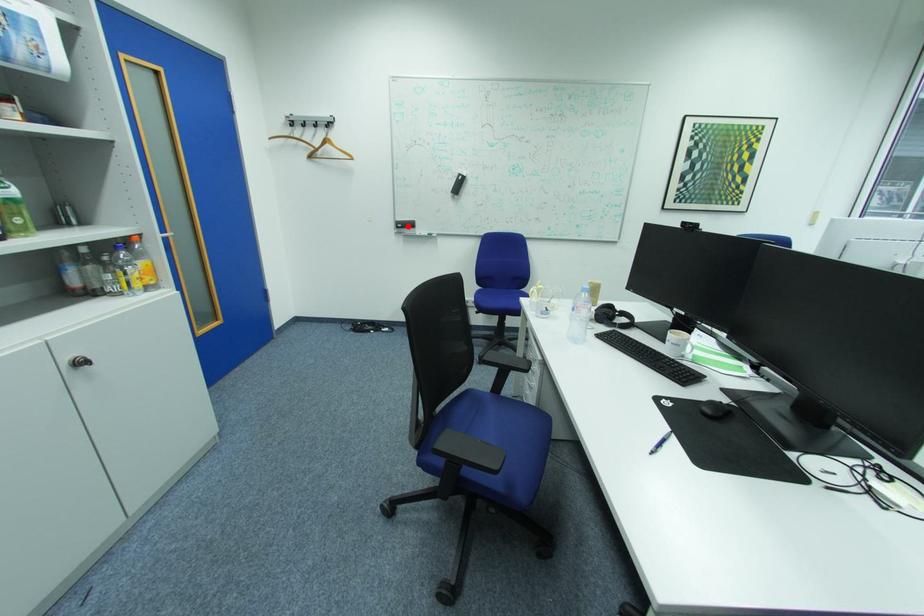
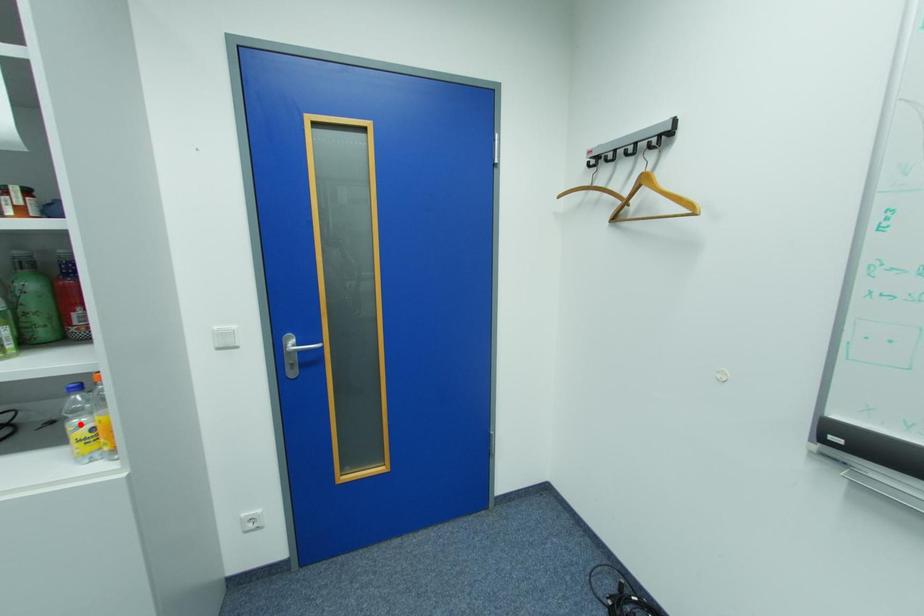
I am providing you with two images of the same scene from different viewpoints. A red point is marked on the first image and another point is marked on the second image. Is the marked point in image1 the same physical position as the marked point in image2?

No